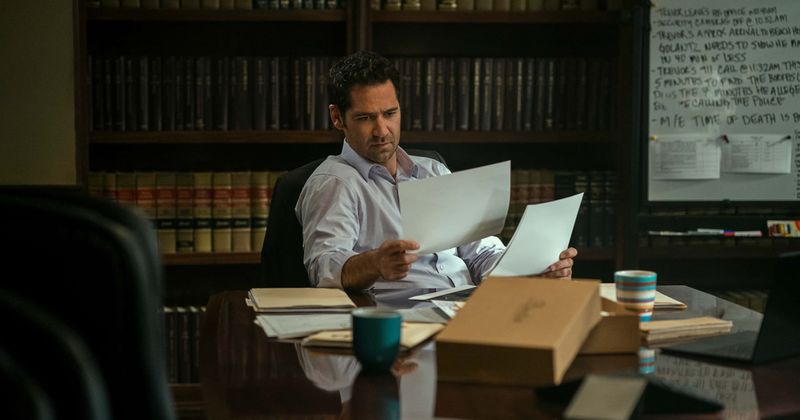
The image size is (800, 420). In order to click on cup in this screenshot , I will do `click(382, 338)`.